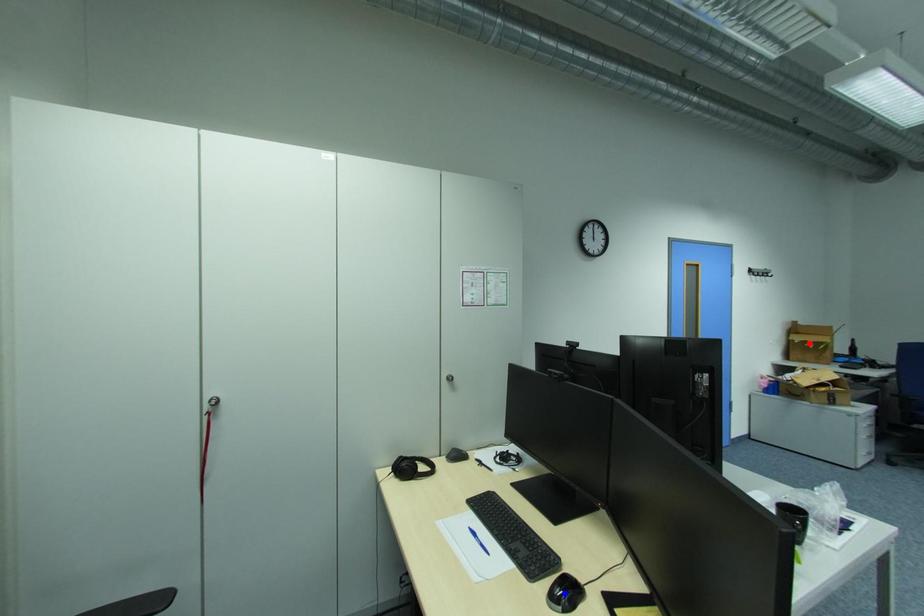
Question: In the image, two points are highlighted. Which point is nearer to the camera? Reply with the corresponding letter.

Choices:
 (A) blue point
 (B) red point

Answer: (A)